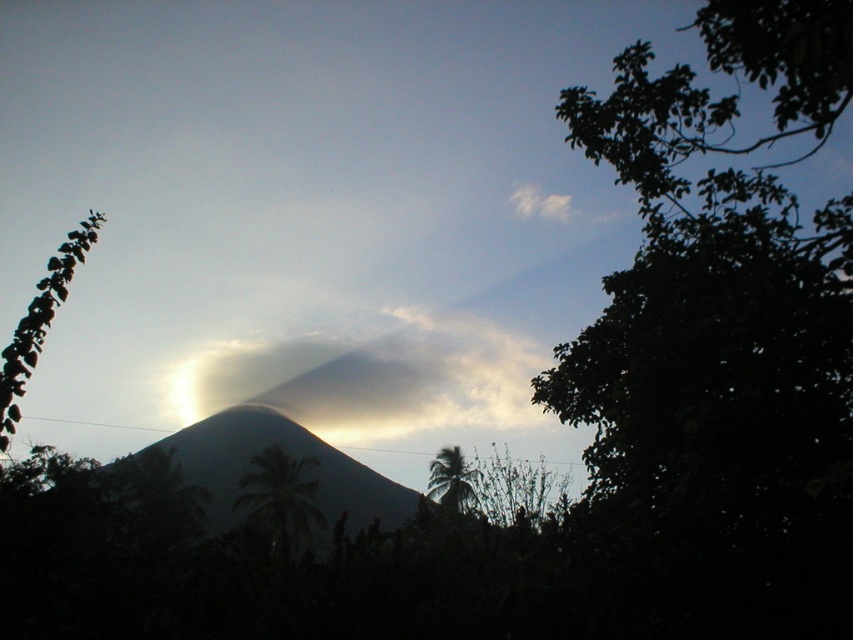
Looking at this image, which of these two, green leafy palm at lower center or green leafy plant at left, stands taller?

Standing taller between the two is green leafy palm at lower center.

Who is positioned more to the right, green leafy palm at lower center or green leafy plant at left?

green leafy palm at lower center is more to the right.

Which is in front, point (296, 468) or point (4, 348)?

Point (4, 348) is in front.

Where is `green leafy palm at lower center`? The width and height of the screenshot is (853, 640). green leafy palm at lower center is located at coordinates (280, 499).

Consider the image. Who is shorter, green leafy palm at lower center or green leafy tree at center?

With less height is green leafy tree at center.

Where is `green leafy palm at lower center`? The height and width of the screenshot is (640, 853). green leafy palm at lower center is located at coordinates (280, 499).

Is smokey gray cloud at center behind green leafy palm at lower center?

That is True.

Who is more forward, (207, 401) or (308, 456)?

Positioned in front is point (308, 456).

Which is behind, point (497, 413) or point (276, 458)?

Point (497, 413)

This screenshot has width=853, height=640. I want to click on smokey gray cloud at center, so click(x=392, y=380).